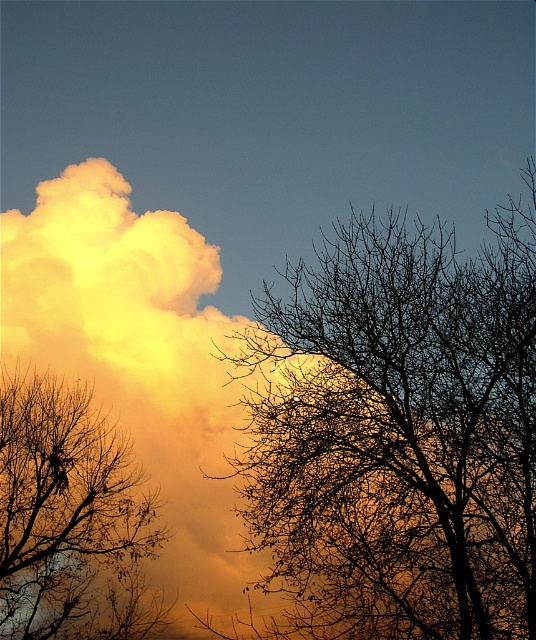
You are an artist trying to paint this scene. You want to ensure the silhouette bare tree at center and the silhouette bare branches at left are proportionally accurate. Which one should you draw larger?

The silhouette bare tree at center should be drawn larger because it is larger in size than the silhouette bare branches at left according to the description.

You are standing in front of the dramatic sky scene. You notice two points in the image. The first point is at coordinate point (524,508) and the second point is at coordinate point (87,586). Which point is closer to you?

Point (524,508) is closer to the camera than point (87,586).

You are an artist sketching the scene. You want to draw the silhouette bare tree at center and silhouette bare branches at left accurately. Which one should you draw first if you follow the left to right direction?

You should draw the silhouette bare branches at left first because it is positioned to the left of the silhouette bare tree at center, following the left to right direction.